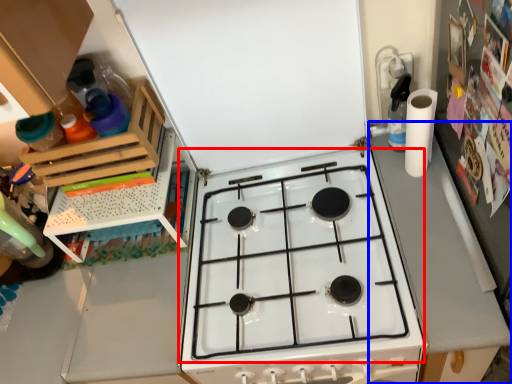
Question: Which object is closer to the camera taking this photo, gas stove (highlighted by a red box) or counter top (highlighted by a blue box)?

Choices:
 (A) gas stove
 (B) counter top

Answer: (B)